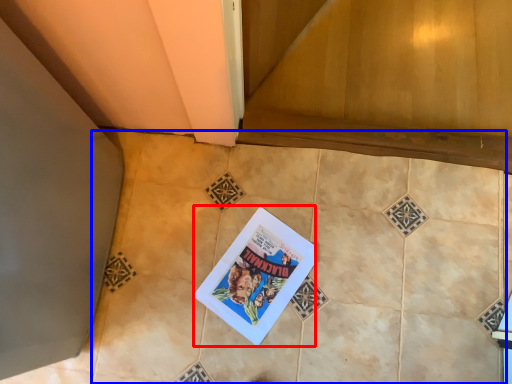
Question: Which object appears farthest to the camera in this image, comic book (highlighted by a red box) or ceramic tile (highlighted by a blue box)?

Choices:
 (A) comic book
 (B) ceramic tile

Answer: (A)